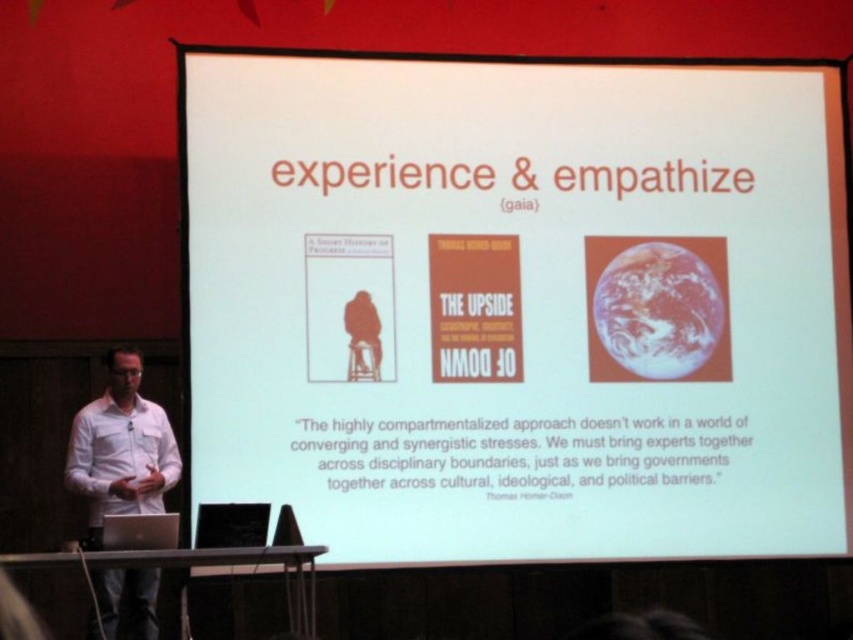
Question: Is white paper at center above white shirt at left?

Choices:
 (A) no
 (B) yes

Answer: (B)

Question: Is white paper at center further to camera compared to silver metallic laptop at lower left?

Choices:
 (A) no
 (B) yes

Answer: (B)

Question: Based on their relative distances, which object is farther from the white paper at center?

Choices:
 (A) silver metallic laptop at lower left
 (B) white shirt at left

Answer: (A)

Question: Which of the following is the farthest from the observer?

Choices:
 (A) white paper at center
 (B) white shirt at left

Answer: (A)

Question: Which object is positioned farthest from the white paper at center?

Choices:
 (A) silver metallic laptop at lower left
 (B) white shirt at left

Answer: (A)

Question: Is white paper at center closer to the viewer compared to silver metallic laptop at lower left?

Choices:
 (A) yes
 (B) no

Answer: (B)